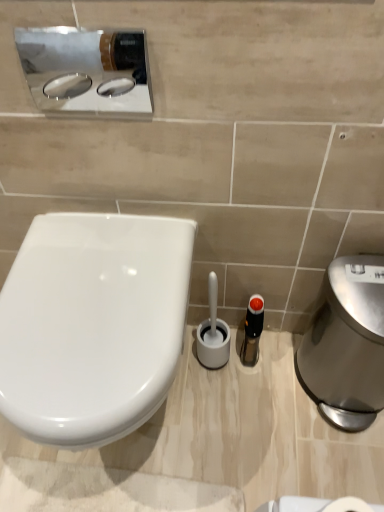
Where is `vacant space to the right of translucent plastic bottle at center`? This screenshot has height=512, width=384. vacant space to the right of translucent plastic bottle at center is located at coordinates (288, 361).